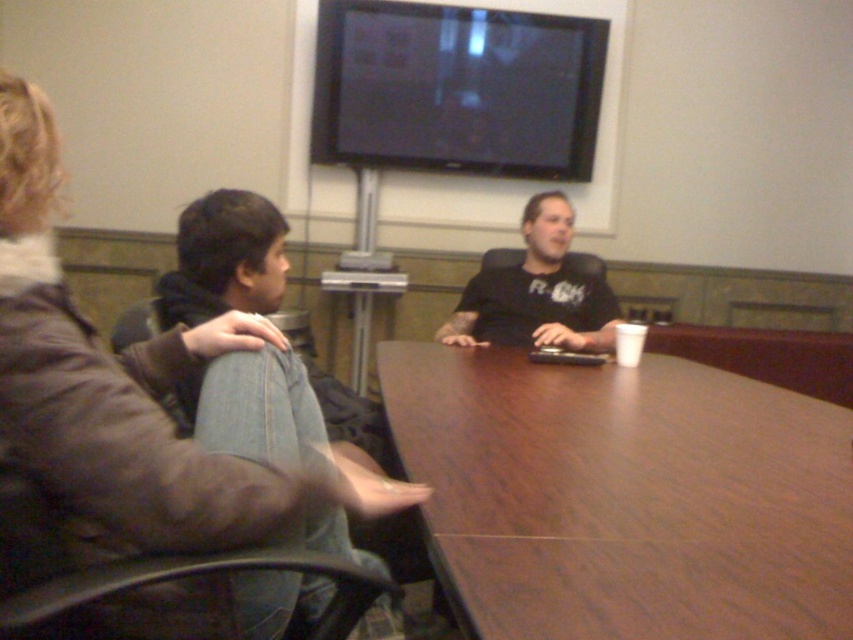
You are standing at the entrance of the conference room and see the brown wood table at center and the black matte shirt at center. Which object is closer to you?

The brown wood table at center is closer to you because it is in front of the black matte shirt at center.